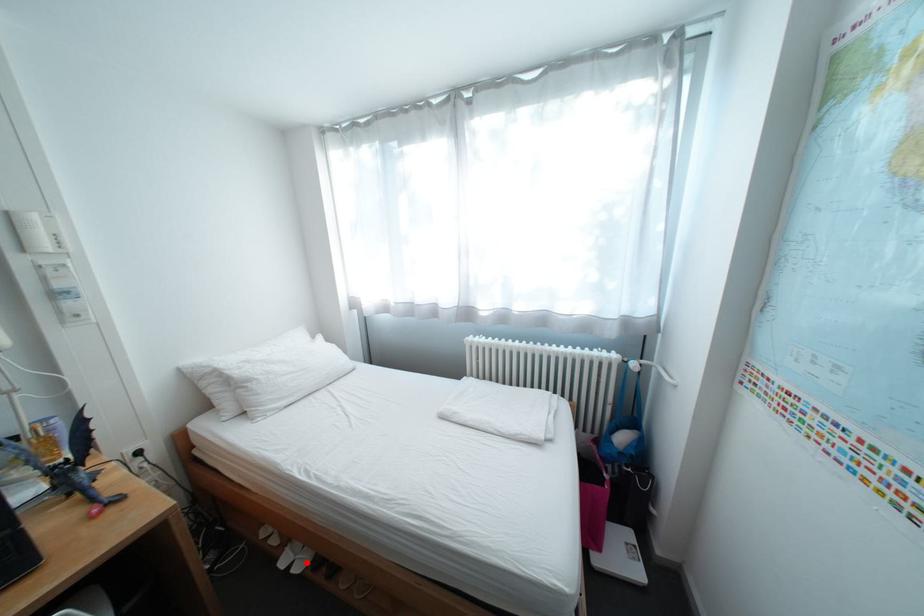
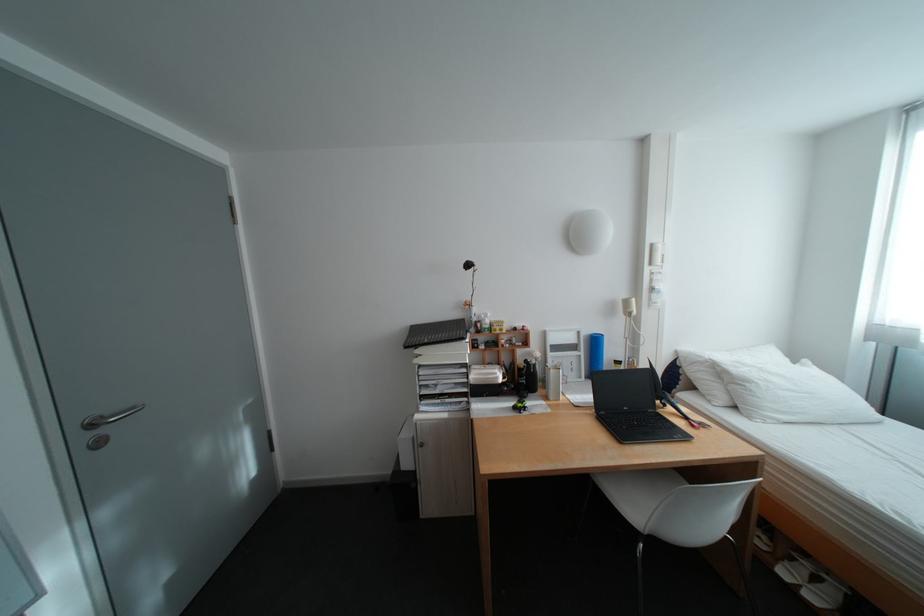
Question: I am providing you with two images of the same scene from different viewpoints. A red point is marked on the first image. Can you still see the location of the red point in image 2?

Choices:
 (A) Yes
 (B) No

Answer: (A)